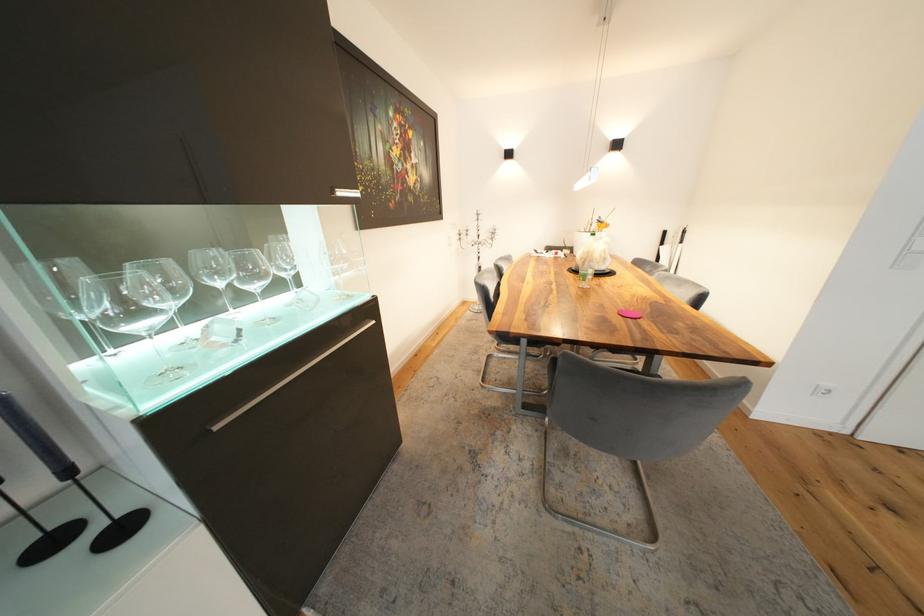
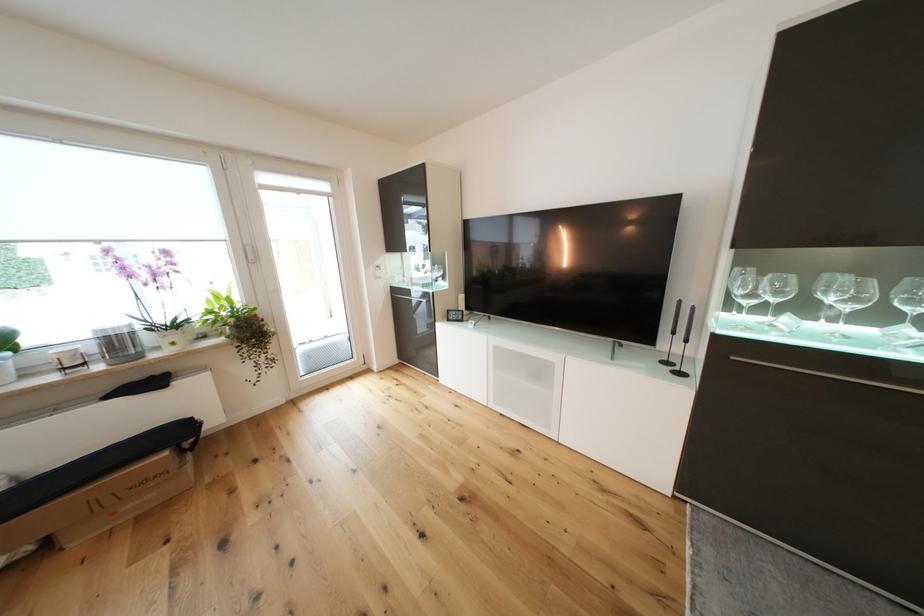
The point at [290,276] is marked in the first image. Where is the corresponding point in the second image?

(913, 310)